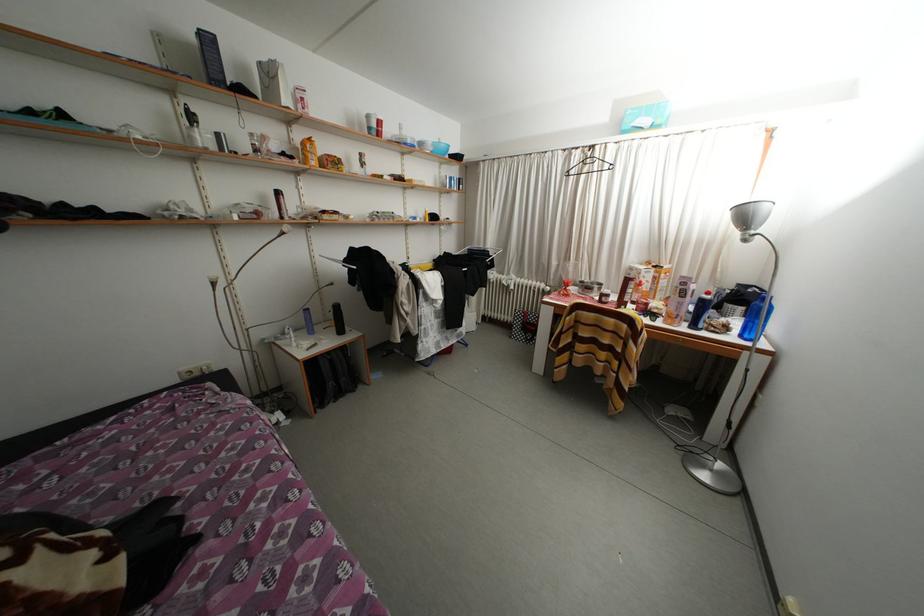
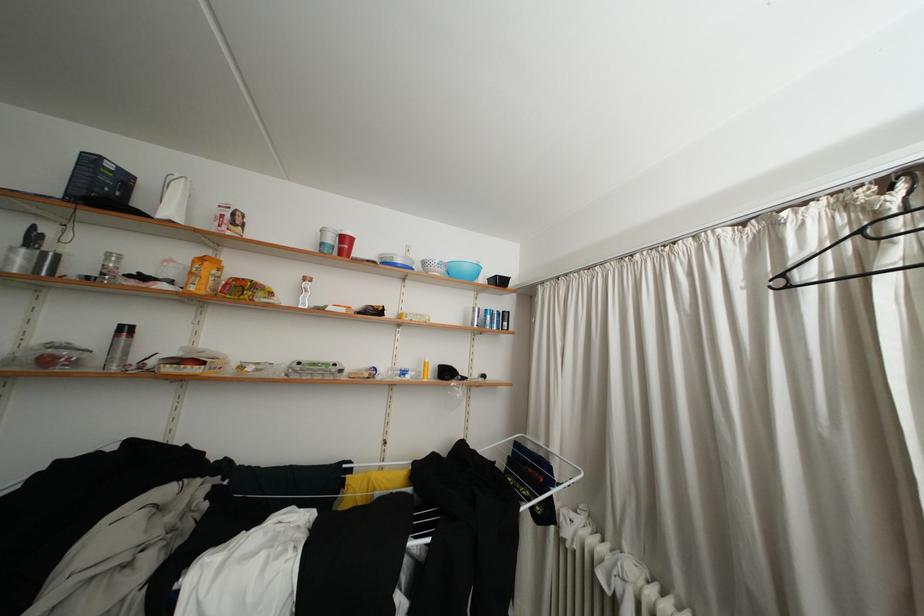
Where in the second image is the point corresponding to (382,130) from the first image?

(338, 245)